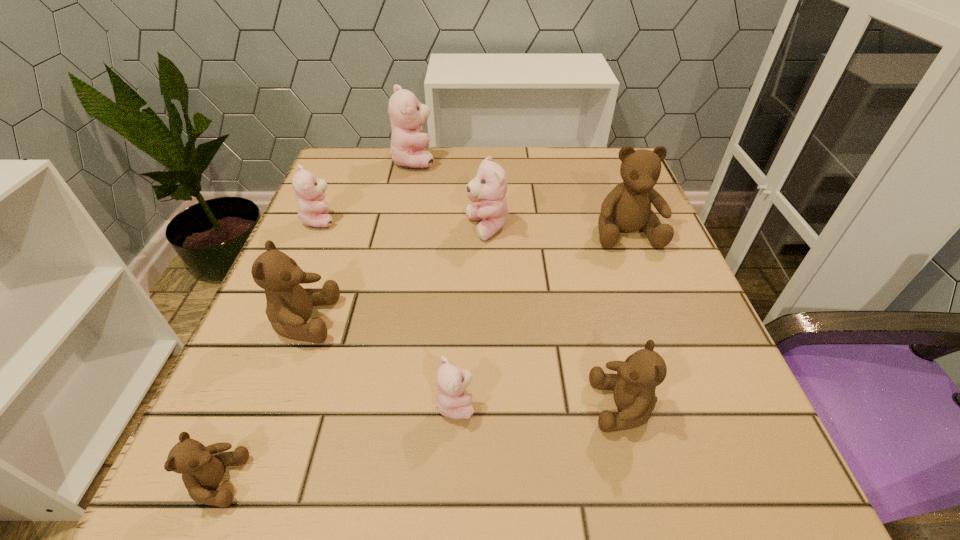
Where is `free location located on the front-facing side of the second nearest brown teddy bear`? Image resolution: width=960 pixels, height=540 pixels. free location located on the front-facing side of the second nearest brown teddy bear is located at coordinates [x=507, y=406].

You are a GUI agent. You are given a task and a screenshot of the screen. Output one action in this format:
    pyautogui.click(x=<x>, y=<y>)
    Task: Click on the vacant space situated at the face of the nearest pink teddy bear
    This screenshot has width=960, height=540.
    Given the screenshot: What is the action you would take?
    pyautogui.click(x=565, y=404)

Where is `vacant region located 0.270m on the front-facing side of the nearest brown teddy bear`? vacant region located 0.270m on the front-facing side of the nearest brown teddy bear is located at coordinates (x=460, y=481).

This screenshot has height=540, width=960. Identify the location of object that is positioned at the far edge. (407, 115).

Find the location of a particular element. The image size is (960, 540). object located at the near edge is located at coordinates (202, 468).

Where is `object located in the far left corner section of the desktop`? This screenshot has width=960, height=540. object located in the far left corner section of the desktop is located at coordinates (407, 115).

Find the location of a particular element. Image resolution: width=960 pixels, height=540 pixels. object present at the near left corner is located at coordinates (202, 468).

The height and width of the screenshot is (540, 960). I want to click on free region at the far edge, so click(x=517, y=181).

Locate an element on the screen. This screenshot has width=960, height=540. free space at the near edge of the desktop is located at coordinates (340, 478).

Image resolution: width=960 pixels, height=540 pixels. I want to click on free point at the left edge, so click(344, 349).